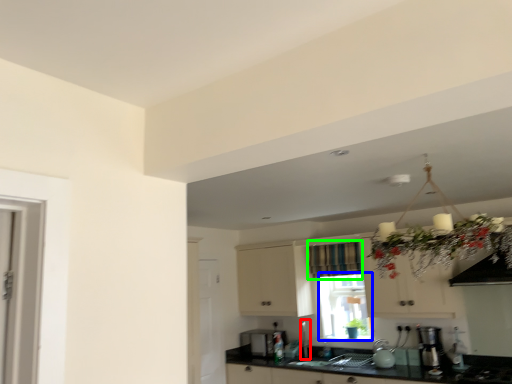
Question: Which is nearer to the faucet (highlighted by a red box)? window screen (highlighted by a blue box) or curtain (highlighted by a green box).

Choices:
 (A) window screen
 (B) curtain

Answer: (A)